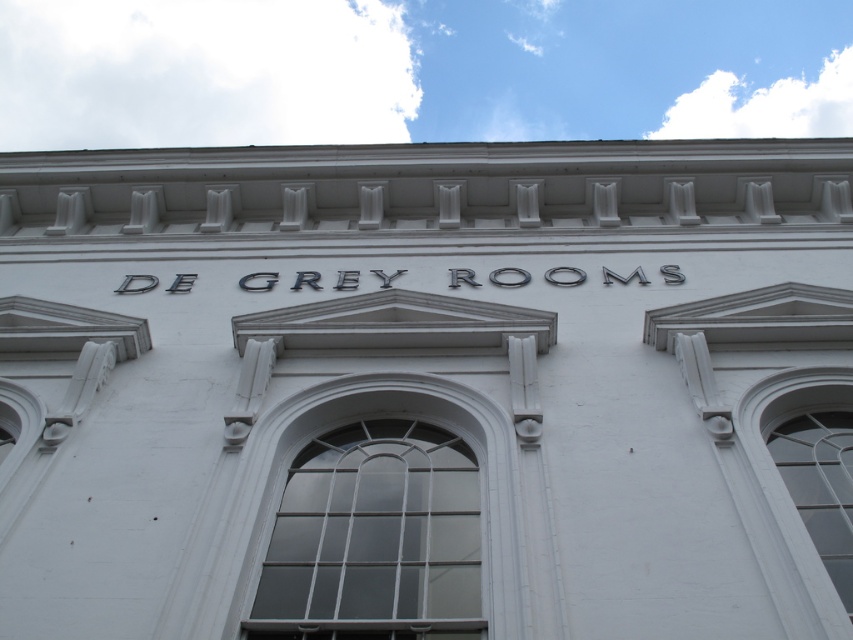
You are standing in front of the De Grey Rooms building. There is a clear glass window at center marked by point (374, 538). If you look directly at the building, where would you expect to find the clear glass window at center?

The clear glass window at center is located at the point marked by coordinates (374, 538), which is at the center of the building.

You are standing in front of the De Grey Rooms building and want to touch the clear glass window at center and the clear glass window at right. Which window should you approach first to reach the one closer to you?

You should approach the clear glass window at center first because it is closer to the viewer than the clear glass window at right.